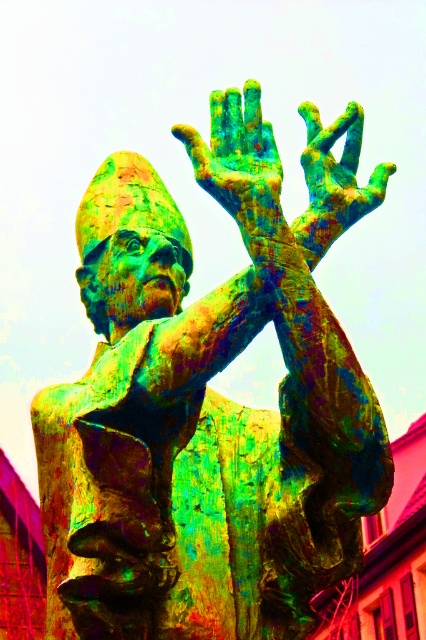
Who is more distant from viewer, (258,113) or (314,196)?

Positioned behind is point (314,196).

Find the location of a particular element. bronze textured hand at upper center is located at coordinates (238, 161).